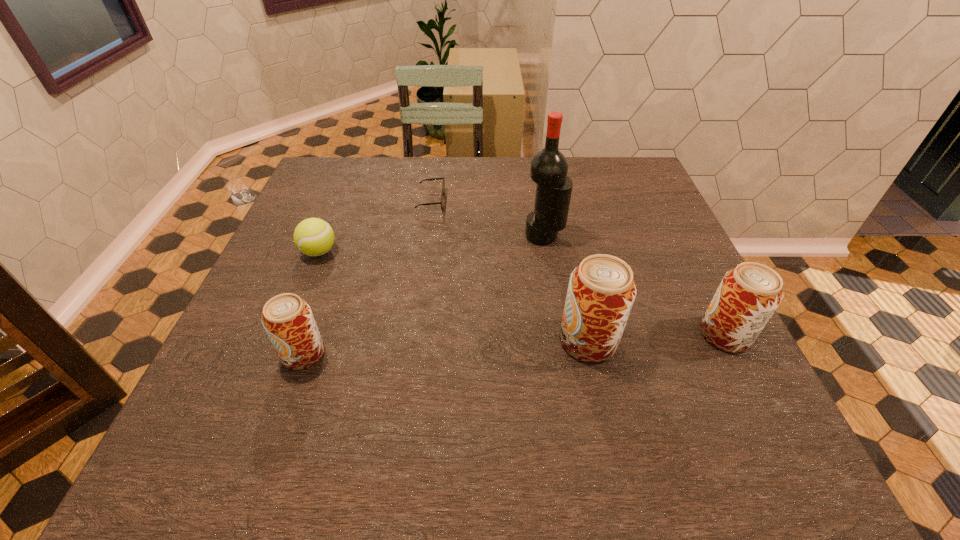
This screenshot has width=960, height=540. In order to click on object that is at the near left corner in this screenshot , I will do `click(287, 319)`.

This screenshot has width=960, height=540. Find the location of `free space at the far edge of the desktop`. free space at the far edge of the desktop is located at coordinates (454, 158).

Where is `vacant region at the near edge of the desktop`? Image resolution: width=960 pixels, height=540 pixels. vacant region at the near edge of the desktop is located at coordinates (521, 375).

Where is `vacant point at the left edge`? vacant point at the left edge is located at coordinates (356, 200).

Find the location of a particular element. Image resolution: width=960 pixels, height=540 pixels. free space at the right edge is located at coordinates (607, 213).

The width and height of the screenshot is (960, 540). In the image, there is a desktop. Identify the location of free space at the far left corner. (343, 173).

Where is `free space at the far right corner of the desktop`? Image resolution: width=960 pixels, height=540 pixels. free space at the far right corner of the desktop is located at coordinates (626, 161).

Find the location of a particular element. vacant space in between the fourth object from right to left and the second beer can from right to left is located at coordinates (510, 271).

Locate an element on the screen. blank region between the second beer can from right to left and the farthest object is located at coordinates (510, 271).

What are the coordinates of `empty space between the third object from left to right and the leftmost beer can` in the screenshot? It's located at (367, 277).